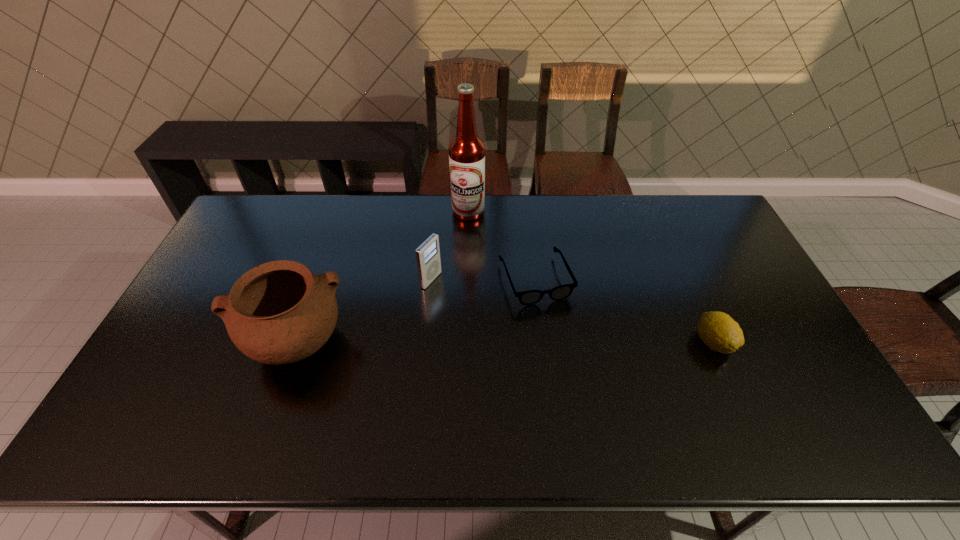
This screenshot has width=960, height=540. Identify the location of empty location between the shortest object and the second shortest object. (624, 310).

The image size is (960, 540). I want to click on vacant area that lies between the fourth object from left to right and the second tallest object, so click(415, 311).

Image resolution: width=960 pixels, height=540 pixels. Identify the location of free space between the second object from left to right and the leftmost object. (363, 311).

Where is `vacant space that is in between the shortest object and the second object from left to right`? This screenshot has height=540, width=960. vacant space that is in between the shortest object and the second object from left to right is located at coordinates (483, 280).

Image resolution: width=960 pixels, height=540 pixels. In order to click on free point between the pottery and the rightmost object in this screenshot , I will do `click(504, 342)`.

This screenshot has width=960, height=540. What are the coordinates of `free point between the alcohol and the fourth tallest object` in the screenshot? It's located at (590, 277).

Identify the location of vacant area that lies between the third object from right to left and the leftmost object. (382, 277).

Find the location of a particular element. unoccupied position between the third tallest object and the spectacles is located at coordinates (483, 280).

At what (x,y) coordinates should I click in order to perform the action: click on object that is the third closest to the fourth object from left to right. Please return your answer as a coordinate pair (x, y). Looking at the image, I should click on (718, 330).

Select which object appears as the closest to the shortest object. Please provide its 2D coordinates. Your answer should be formatted as a tuple, i.e. [(x, y)], where the tuple contains the x and y coordinates of a point satisfying the conditions above.

[(467, 153)]